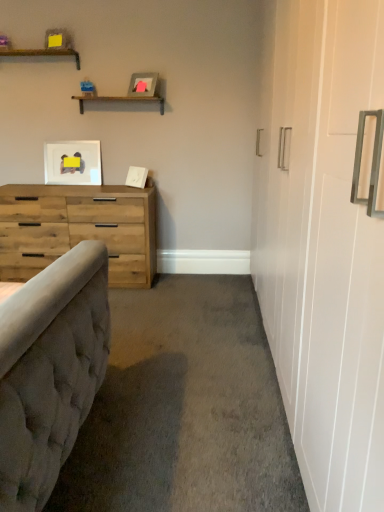
Where is `vacant space that is to the left of matte white picture frame at upper left, acting as the second picture frame starting from the right`? The height and width of the screenshot is (512, 384). vacant space that is to the left of matte white picture frame at upper left, acting as the second picture frame starting from the right is located at coordinates [x=46, y=183].